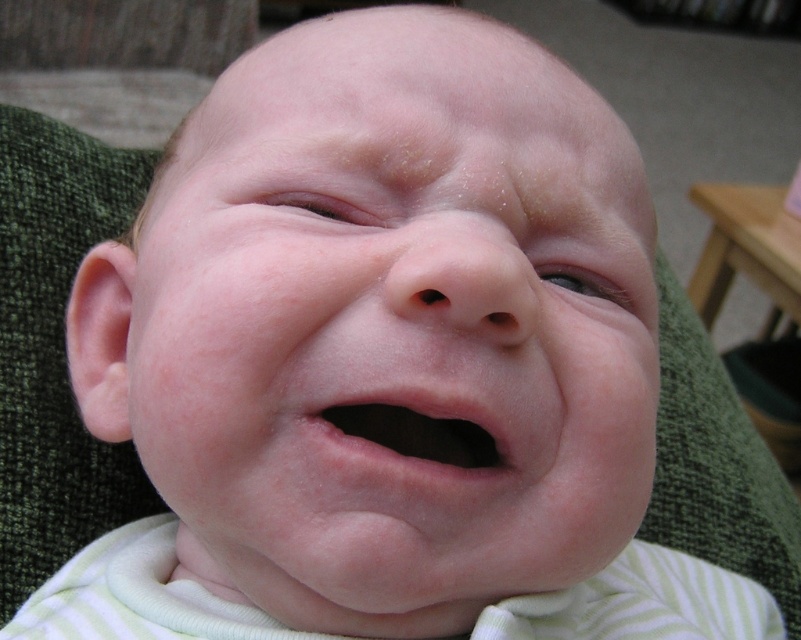
Question: Is smooth skin face at center above pink smooth lips at center?

Choices:
 (A) yes
 (B) no

Answer: (A)

Question: Which point is closer to the camera?

Choices:
 (A) (550, 435)
 (B) (449, 452)

Answer: (A)

Question: Which object appears farthest from the camera in this image?

Choices:
 (A) smooth skin face at center
 (B) pink smooth lips at center

Answer: (B)

Question: Is the position of smooth skin face at center more distant than that of pink smooth lips at center?

Choices:
 (A) yes
 (B) no

Answer: (B)

Question: Does smooth skin face at center have a smaller size compared to pink smooth lips at center?

Choices:
 (A) no
 (B) yes

Answer: (A)